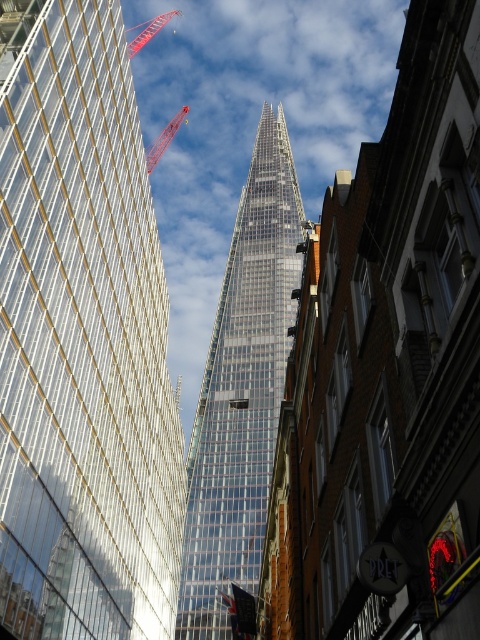
Between transparent glass skyscraper at center and transparent glass tower at center, which one appears on the right side from the viewer's perspective?

transparent glass tower at center is more to the right.

Is transparent glass skyscraper at center further to the viewer compared to transparent glass tower at center?

No, it is not.

Who is more distant from viewer, (34,360) or (239,348)?

The point (239,348) is more distant.

The width and height of the screenshot is (480, 640). What are the coordinates of `transparent glass skyscraper at center` in the screenshot? It's located at 82,339.

Can you confirm if transparent glass skyscraper at center is positioned above metallic red crane at upper center?

Actually, transparent glass skyscraper at center is below metallic red crane at upper center.

Is transparent glass skyscraper at center bigger than metallic red crane at upper center?

No.

Image resolution: width=480 pixels, height=640 pixels. Describe the element at coordinates (82, 339) in the screenshot. I see `transparent glass skyscraper at center` at that location.

This screenshot has width=480, height=640. I want to click on transparent glass skyscraper at center, so click(x=82, y=339).

Is point (0, 426) in front of point (169, 128)?

Yes, point (0, 426) is in front of point (169, 128).

Is transparent glass skyscraper at center closer to camera compared to red metal crane at upper left?

Yes, transparent glass skyscraper at center is closer to the viewer.

Who is more forward, [103,528] or [152,150]?

Point [103,528] is in front.

What are the coordinates of `transparent glass skyscraper at center` in the screenshot? It's located at (82, 339).